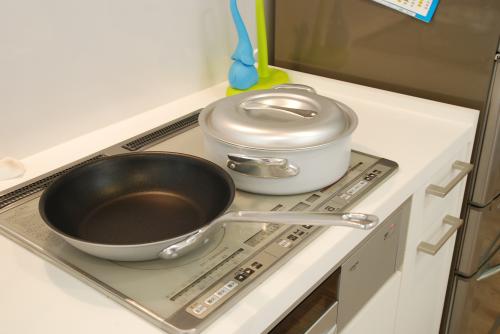
I want to click on buttons to control stove top, so click(204, 304), click(276, 246), click(335, 203), click(373, 165).